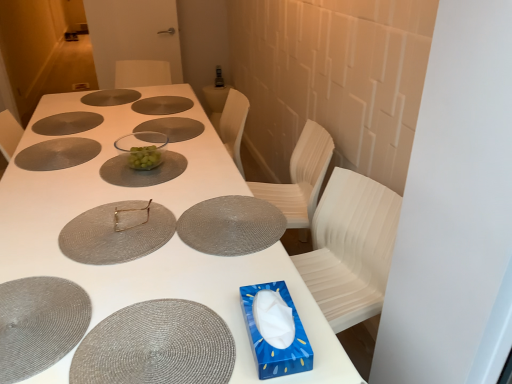
Where is `free space between transparent glass bowl at center, the fourth glass plate viewed from the back, and transparent glass bowl at center`? The height and width of the screenshot is (384, 512). free space between transparent glass bowl at center, the fourth glass plate viewed from the back, and transparent glass bowl at center is located at coordinates (156, 144).